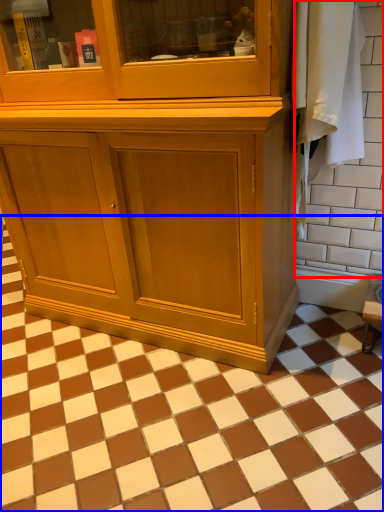
Question: Which object appears farthest to the camera in this image, ceramic tile (highlighted by a red box) or ceramic tile (highlighted by a blue box)?

Choices:
 (A) ceramic tile
 (B) ceramic tile

Answer: (A)